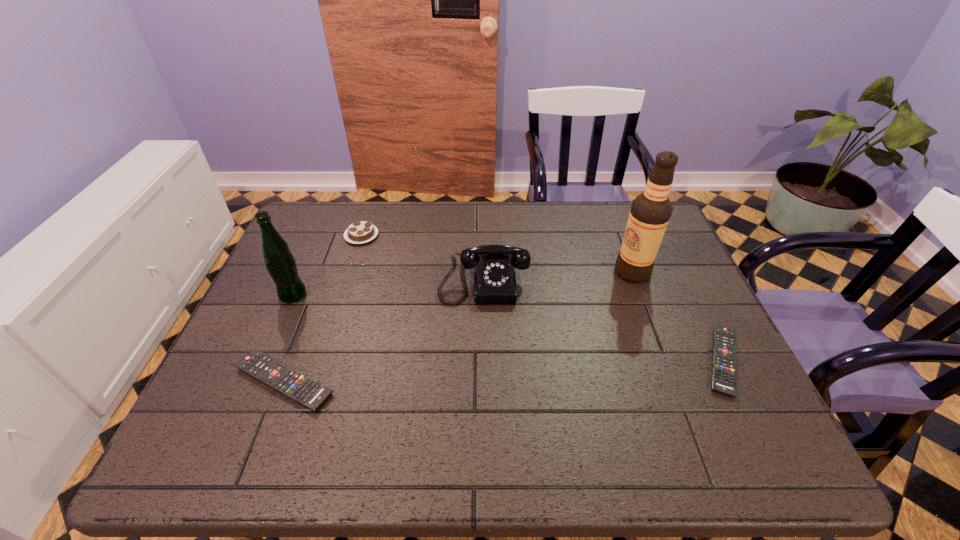
You are a GUI agent. You are given a task and a screenshot of the screen. Output one action in this format:
    pyautogui.click(x=<x>, y=<y>)
    Task: Click on the remote control that is at the left edge
    
    Given the screenshot: What is the action you would take?
    pyautogui.click(x=306, y=391)

I want to click on beer bottle located in the left edge section of the desktop, so click(281, 265).

The width and height of the screenshot is (960, 540). Find the location of `remote control present at the right edge`. remote control present at the right edge is located at coordinates (724, 343).

The height and width of the screenshot is (540, 960). I want to click on alcohol that is at the right edge, so tap(650, 212).

Where is `object that is at the near left corner`? This screenshot has height=540, width=960. object that is at the near left corner is located at coordinates (306, 391).

You are a GUI agent. You are given a task and a screenshot of the screen. Output one action in this format:
    pyautogui.click(x=<x>, y=<y>)
    Task: Click on the object present at the near right corner
    The image size is (960, 540).
    Given the screenshot: What is the action you would take?
    (724, 343)

Find the location of a particular element. The width and height of the screenshot is (960, 540). blank space at the far edge of the desktop is located at coordinates click(579, 207).

In the image, there is a desktop. What are the coordinates of `vacant space at the left edge` in the screenshot? It's located at (306, 278).

Find the location of a particular element. This screenshot has width=960, height=540. free location at the right edge of the desktop is located at coordinates (669, 361).

Image resolution: width=960 pixels, height=540 pixels. In the image, there is a desktop. In order to click on blank space at the far left corner in this screenshot , I will do `click(329, 239)`.